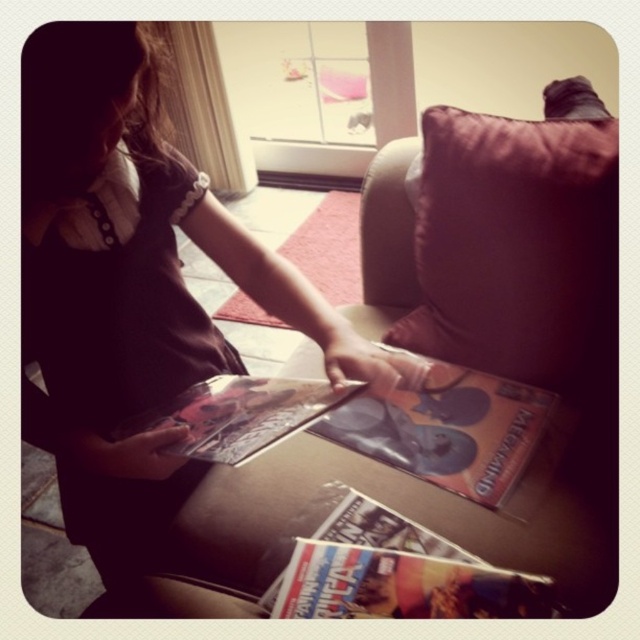
Question: Can you confirm if matte brown dress at center is positioned to the left of suede-like beige couch at center?

Choices:
 (A) yes
 (B) no

Answer: (A)

Question: Estimate the real-world distances between objects in this image. Which object is farther from the suede-like beige couch at center?

Choices:
 (A) matte paper comic book at lower center
 (B) matte brown dress at center

Answer: (B)

Question: Based on their relative distances, which object is farther from the matte paper comic book at lower center?

Choices:
 (A) matte brown dress at center
 (B) suede-like beige couch at center
 (C) metallic glossy magazine at center
 (D) matte cardboard magazine at center

Answer: (A)

Question: Which point is farther to the camera?

Choices:
 (A) (536, 426)
 (B) (392, 540)
 (C) (195, 458)
 (D) (148, 385)

Answer: (A)

Question: Is suede-like beige couch at center further to the viewer compared to matte cardboard magazine at center?

Choices:
 (A) yes
 (B) no

Answer: (B)

Question: Does matte cardboard magazine at center appear over metallic glossy magazine at center?

Choices:
 (A) no
 (B) yes

Answer: (A)